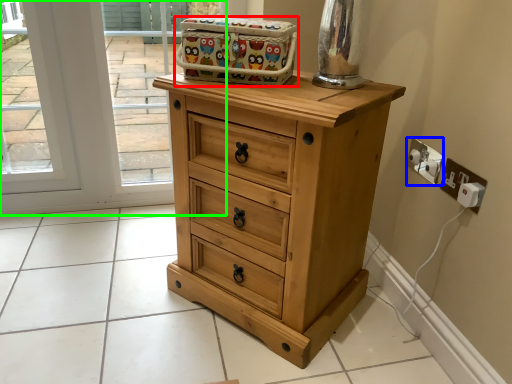
Question: Considering the real-world distances, which object is farthest from crate (highlighted by a red box)? electric outlet (highlighted by a blue box) or window sill (highlighted by a green box)?

Choices:
 (A) electric outlet
 (B) window sill

Answer: (B)